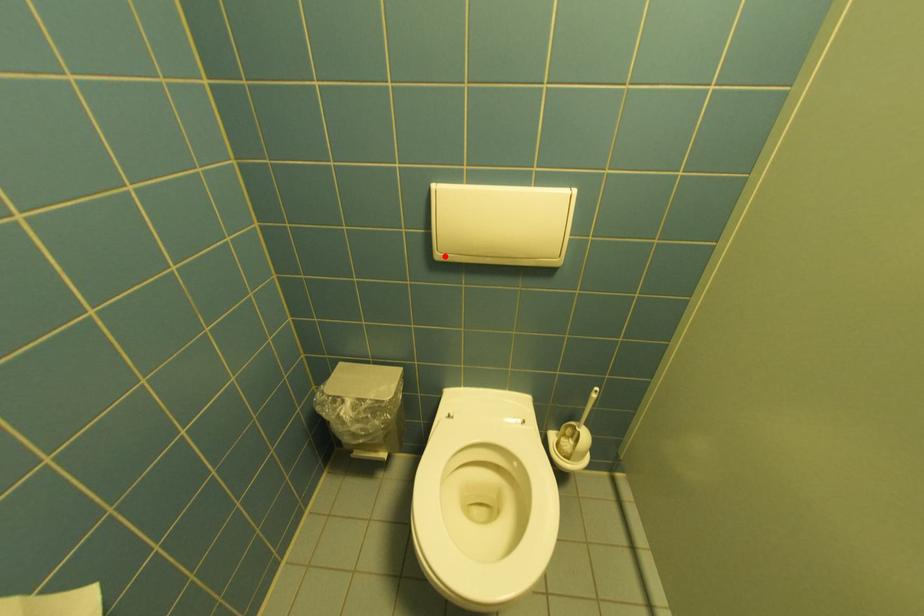
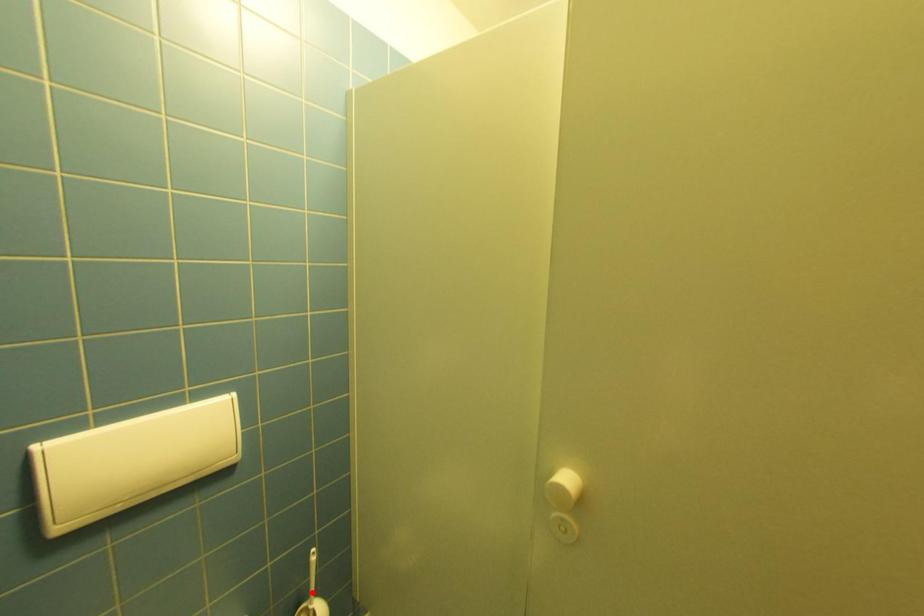
I am providing you with two images of the same scene from different viewpoints. A red point is marked on the first image and another point is marked on the second image. Are the points marked in image1 and image2 representing the same 3D position?

No